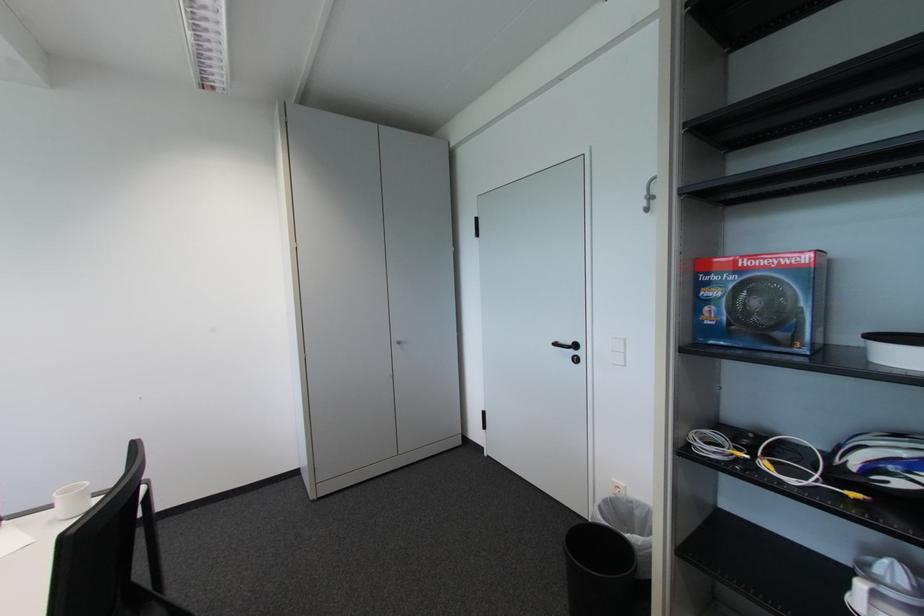
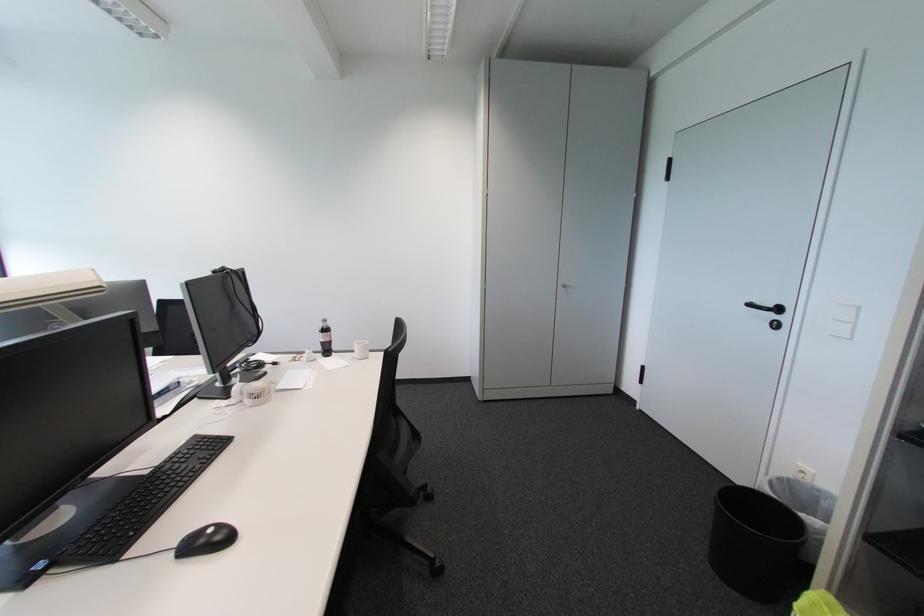
Where in the second image is the point corresponding to pixel 403 347 from the first image?

(567, 290)